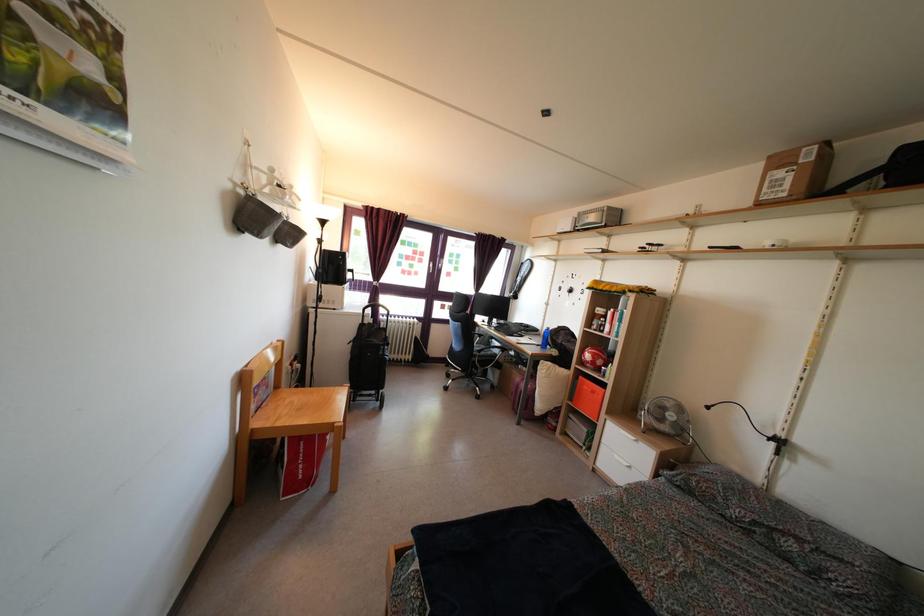
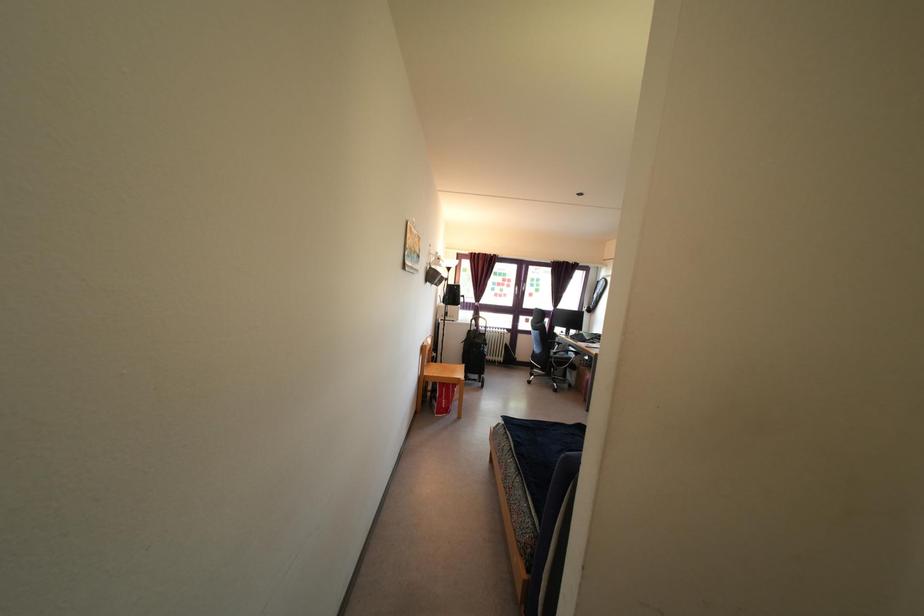
The point at (365, 334) is marked in the first image. Where is the corresponding point in the second image?

(472, 339)